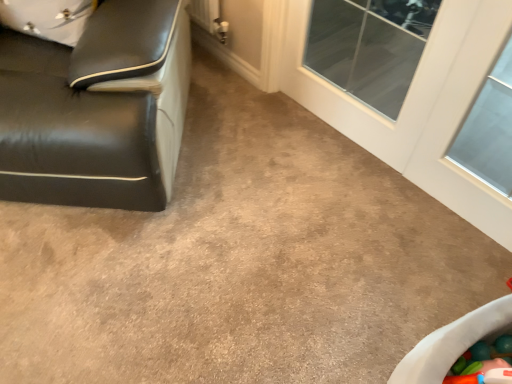
Question: Does transparent glass door at upper right have a greater height compared to black leather couch at left?

Choices:
 (A) no
 (B) yes

Answer: (A)

Question: From the image's perspective, is transparent glass door at upper right below black leather couch at left?

Choices:
 (A) no
 (B) yes

Answer: (B)

Question: From the image's perspective, is transparent glass door at upper right over black leather couch at left?

Choices:
 (A) no
 (B) yes

Answer: (A)

Question: Is transparent glass door at upper right facing away from black leather couch at left?

Choices:
 (A) yes
 (B) no

Answer: (B)

Question: Is transparent glass door at upper right positioned behind black leather couch at left?

Choices:
 (A) yes
 (B) no

Answer: (A)

Question: Is transparent glass door at upper right wider than black leather couch at left?

Choices:
 (A) no
 (B) yes

Answer: (A)

Question: From a real-world perspective, does black leather couch at left stand above transparent glass door at upper right?

Choices:
 (A) yes
 (B) no

Answer: (A)

Question: Does black leather couch at left come in front of transparent glass door at upper right?

Choices:
 (A) no
 (B) yes

Answer: (B)

Question: Considering the relative positions of black leather couch at left and transparent glass door at upper right in the image provided, is black leather couch at left to the right of transparent glass door at upper right from the viewer's perspective?

Choices:
 (A) yes
 (B) no

Answer: (B)

Question: From a real-world perspective, is black leather couch at left located beneath transparent glass door at upper right?

Choices:
 (A) no
 (B) yes

Answer: (A)

Question: Can you confirm if black leather couch at left is taller than transparent glass door at upper right?

Choices:
 (A) no
 (B) yes

Answer: (B)

Question: Does black leather couch at left have a greater width compared to transparent glass door at upper right?

Choices:
 (A) no
 (B) yes

Answer: (B)

Question: Would you say transparent glass door at upper right is inside or outside black leather couch at left?

Choices:
 (A) inside
 (B) outside

Answer: (B)